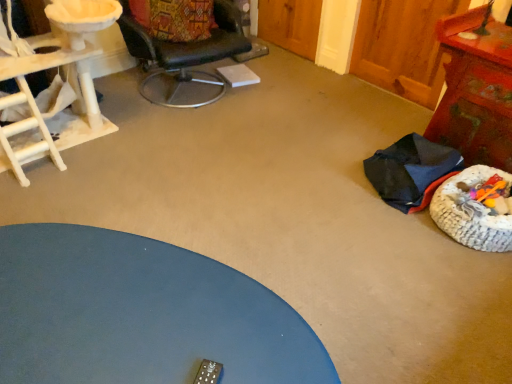
Question: Considering their positions, is black leather chair at upper center, the second chair when ordered from bottom to top, located in front of or behind wooden textured table at right, which ranks as the 1th table in back-to-front order?

Choices:
 (A) front
 (B) behind

Answer: (B)

Question: From the image's perspective, is black leather chair at upper center, the second chair when ordered from bottom to top, positioned above or below wooden textured table at right, acting as the first table starting from the right?

Choices:
 (A) below
 (B) above

Answer: (B)

Question: Estimate the real-world distances between objects in this image. Which object is farther from the white wood cat tree at left?

Choices:
 (A) black leather chair at upper center, which ranks as the 1th chair in top-to-bottom order
 (B) wooden textured table at right, which is the second table from left to right
 (C) dark blue fabric chair at lower right, the first chair when ordered from bottom to top
 (D) rustic woven basket at lower right
 (E) blue matte table at lower left, which appears as the 1th table when viewed from the front

Answer: (D)

Question: Which is nearer to the rustic woven basket at lower right?

Choices:
 (A) blue matte table at lower left, which appears as the 1th table when viewed from the front
 (B) black leather chair at upper center, placed as the 2th chair when sorted from right to left
 (C) wooden textured table at right, which ranks as the 1th table in back-to-front order
 (D) dark blue fabric chair at lower right, which is the second chair in left-to-right order
 (E) white wood cat tree at left

Answer: (D)